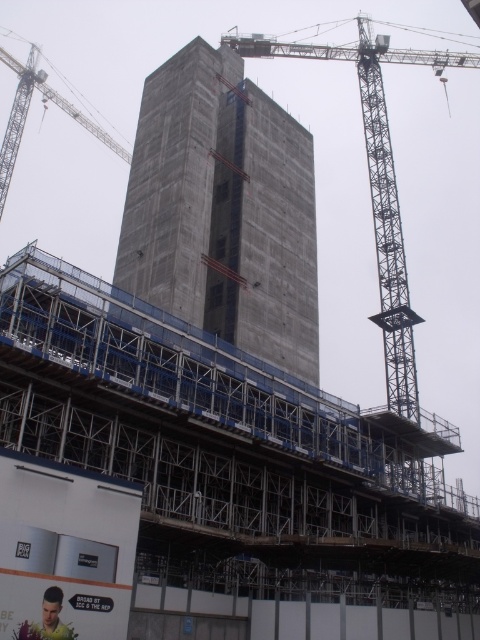
Which of these two, concrete at center or yellow shirt at lower left, stands taller?

concrete at center is taller.

Is concrete at center below yellow shirt at lower left?

Actually, concrete at center is above yellow shirt at lower left.

Is point (203, 138) behind point (54, 602)?

Yes, it is behind point (54, 602).

In order to click on concrete at center in this screenshot , I will do `click(224, 209)`.

Can you confirm if concrete at center is positioned below gray metallic crane at center?

Correct, concrete at center is located below gray metallic crane at center.

Between concrete at center and gray metallic crane at center, which one is positioned higher?

gray metallic crane at center is higher up.

Is point (213, 189) positioned before point (233, 49)?

That is True.

Where is `concrete at center`? This screenshot has height=640, width=480. concrete at center is located at coordinates (224, 209).

Consider the image. Does concrete scaffolding at center appear on the left side of gray metallic crane at center?

Correct, you'll find concrete scaffolding at center to the left of gray metallic crane at center.

Between concrete scaffolding at center and gray metallic crane at center, which one appears on the right side from the viewer's perspective?

Positioned to the right is gray metallic crane at center.

Identify the location of concrete scaffolding at center. This screenshot has width=480, height=640. (203, 480).